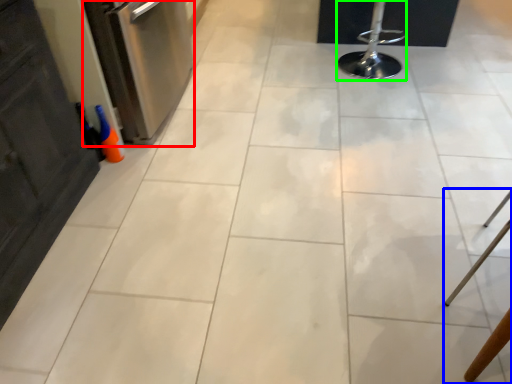
Question: Which is farther away from dish washer (highlighted by a red box)? furniture (highlighted by a blue box) or bar stool (highlighted by a green box)?

Choices:
 (A) furniture
 (B) bar stool

Answer: (A)